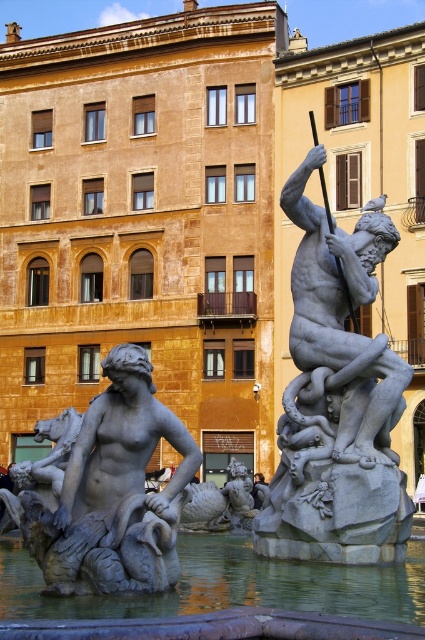
Is matte gray statue at center to the right of clear water at center from the viewer's perspective?

In fact, matte gray statue at center is to the left of clear water at center.

The image size is (425, 640). What do you see at coordinates (113, 492) in the screenshot?
I see `matte gray statue at center` at bounding box center [113, 492].

You are a GUI agent. You are given a task and a screenshot of the screen. Output one action in this format:
    pyautogui.click(x=<x>, y=<y>)
    Task: Click on the matte gray statue at center
    
    Given the screenshot: What is the action you would take?
    pyautogui.click(x=113, y=492)

Who is positioned more to the right, gray stone statue at center or matte gray statue at center?

gray stone statue at center is more to the right.

Is gray stone statue at center further to the viewer compared to matte gray statue at center?

Yes, gray stone statue at center is further from the viewer.

This screenshot has width=425, height=640. What are the coordinates of `gray stone statue at center` in the screenshot? It's located at (337, 401).

Does gray stone statue at center appear on the left side of clear water at center?

Incorrect, gray stone statue at center is not on the left side of clear water at center.

Is point (385, 378) more distant than point (237, 604)?

Yes, it is behind point (237, 604).

The image size is (425, 640). In order to click on gray stone statue at center in this screenshot , I will do `click(337, 401)`.